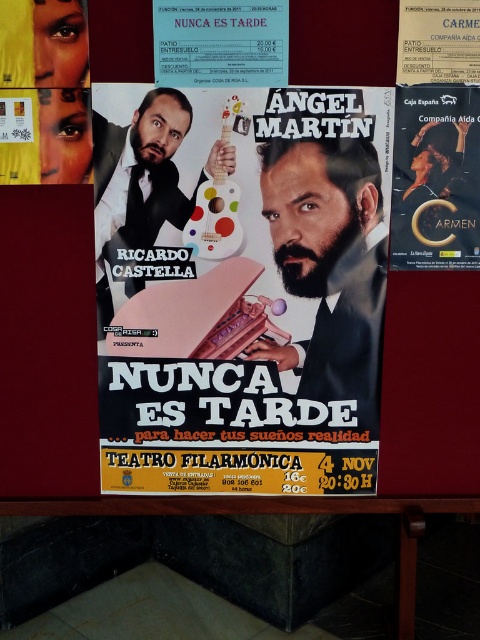
Between matte black suit at center and matte black poster at upper right, which one is positioned lower?

matte black suit at center

Between matte black suit at center and matte black poster at upper right, which one has more height?

With more height is matte black suit at center.

Is point (342, 282) positioned in front of point (459, 148)?

That is False.

Identify the location of matte black suit at center. The height and width of the screenshot is (640, 480). (328, 253).

Is matte black suit at center thinner than matte black guitar at center?

Indeed, matte black suit at center has a lesser width compared to matte black guitar at center.

Is point (280, 147) in front of point (188, 113)?

No, it is behind (188, 113).

Locate an element on the screen. The height and width of the screenshot is (640, 480). matte black suit at center is located at coordinates (328, 253).

Find the location of a particular element. matte pink pastel at center is located at coordinates (242, 289).

Which of these two, matte pink pastel at center or matte black guitar at center, stands shorter?

Standing shorter between the two is matte black guitar at center.

Between point (308, 118) and point (151, 106), which one is positioned behind?

The point (308, 118) is more distant.

Find the location of a particular element. This screenshot has width=480, height=640. matte pink pastel at center is located at coordinates (242, 289).